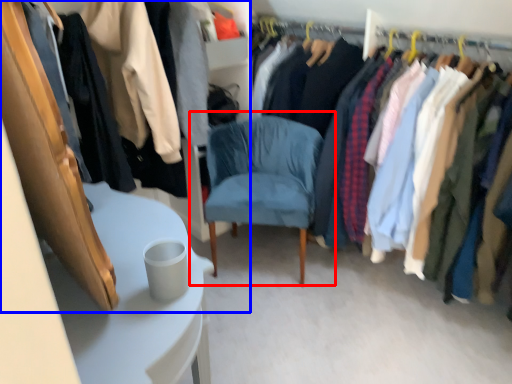
Question: Which object is closer to the camera taking this photo, chair (highlighted by a red box) or closet (highlighted by a blue box)?

Choices:
 (A) chair
 (B) closet

Answer: (B)